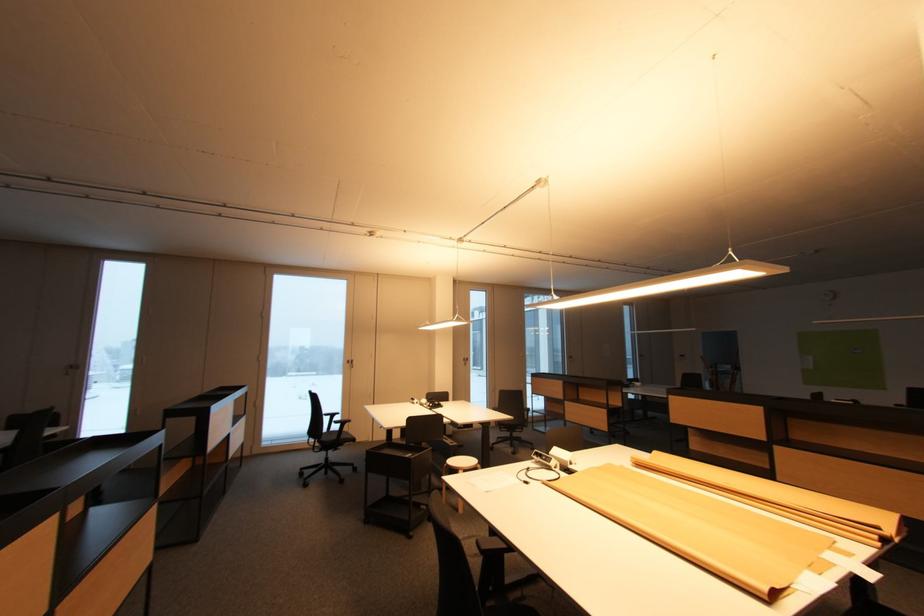
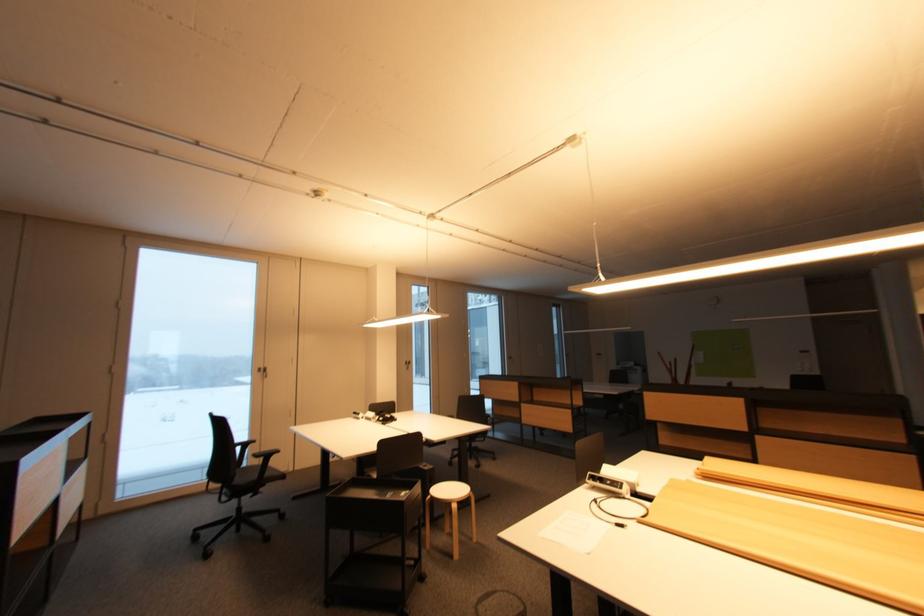
What movement of the cameraman would produce the second image?

The cameraman walked toward left, forward.